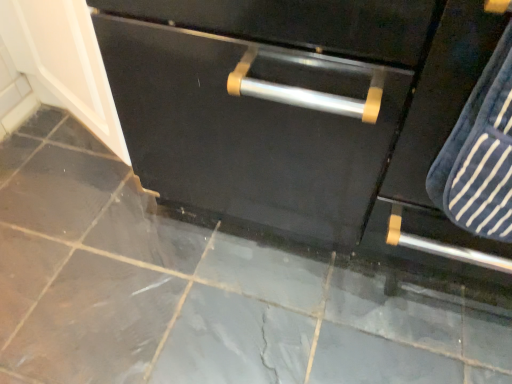
Question: Should I look upward or downward to see matte black cabinet at center?

Choices:
 (A) up
 (B) down

Answer: (A)